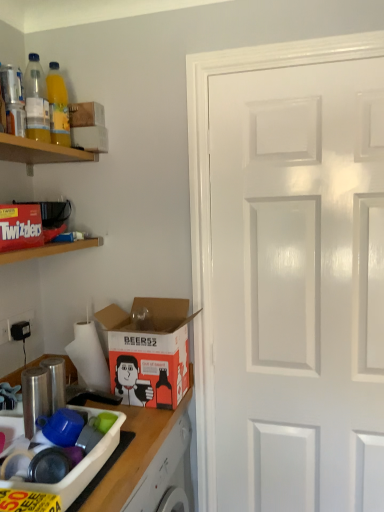
I want to click on free location above matte cardboard box at lower left, which is the 3th box from back to front (from a real-world perspective), so click(x=39, y=440).